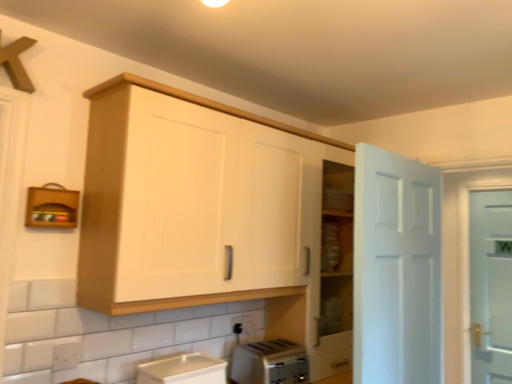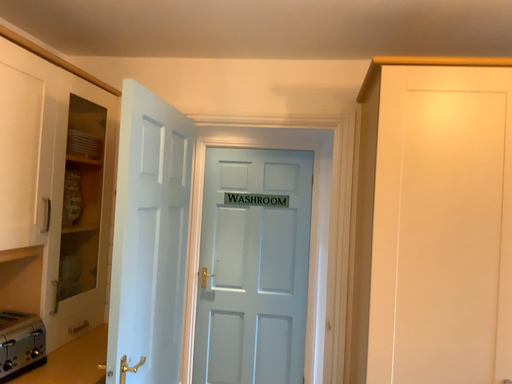
Question: Which way did the camera rotate in the video?

Choices:
 (A) rotated downward
 (B) rotated upward

Answer: (A)